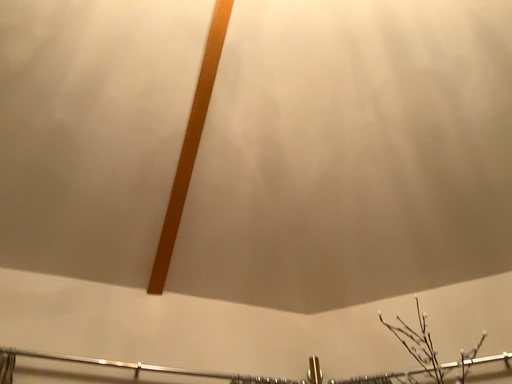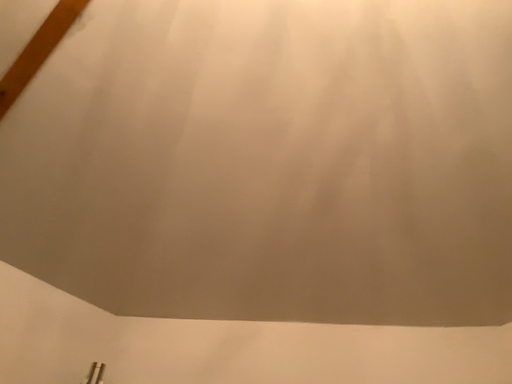
Question: Which way did the camera rotate in the video?

Choices:
 (A) rotated left
 (B) rotated right

Answer: (A)